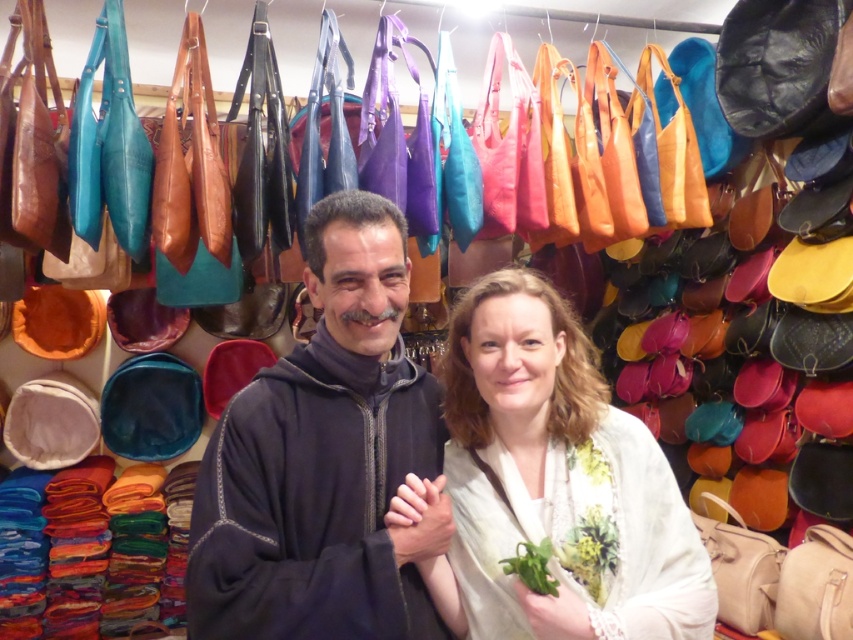
You are a photographer trying to capture the dark blue fabric at center and the matte white scarf at center in a single shot. Which object should you focus on first to ensure both are in focus?

The dark blue fabric at center is closer to the viewer than the matte white scarf at center, so you should focus on the dark blue fabric at center first to ensure both are in focus.

You are a customer in the store and want to buy both the dark blue fabric at center and the matte white scarf at center. The store has a discount for items that are of similar size. Are these two items eligible for the discount?

The dark blue fabric at center has a larger size compared to matte white scarf at center, so they are not of similar size and therefore not eligible for the discount.

Based on the photo, you are a customer in the leather goods store and see the dark blue fabric at center and the matte white scarf at center. Which item is taller?

The dark blue fabric at center is taller than the matte white scarf at center.